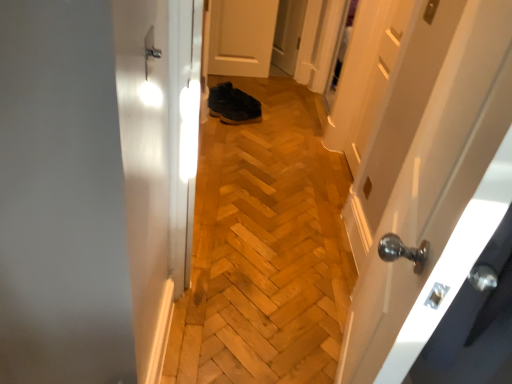
Image resolution: width=512 pixels, height=384 pixels. Find the location of `white matte door at center, marked as the 2th door in a bottom-to-top arrangement`. white matte door at center, marked as the 2th door in a bottom-to-top arrangement is located at coordinates (241, 37).

Can you confirm if satin nickel door handle at upper center is wider than wooden shoes at center?

No, satin nickel door handle at upper center is not wider than wooden shoes at center.

From a real-world perspective, does satin nickel door handle at upper center sit lower than wooden shoes at center?

Incorrect, from a real-world perspective, satin nickel door handle at upper center is higher than wooden shoes at center.

Is point (149, 35) closer to camera compared to point (270, 260)?

Yes, point (149, 35) is closer to viewer.

Is dark brown leather shoes at center with wooden shoes at center?

dark brown leather shoes at center and wooden shoes at center are not in contact.

Is point (224, 106) positioned in front of point (289, 155)?

No, (224, 106) is behind (289, 155).

Where is `corridor on the right of dark brown leather shoes at center`? The image size is (512, 384). corridor on the right of dark brown leather shoes at center is located at coordinates (265, 249).

Which of these two, dark brown leather shoes at center or wooden shoes at center, stands shorter?

With less height is wooden shoes at center.

Considering the sizes of objects white glossy door at right, the 2th door when ordered from top to bottom, and dark brown leather shoes at center in the image provided, who is smaller, white glossy door at right, the 2th door when ordered from top to bottom, or dark brown leather shoes at center?

dark brown leather shoes at center is smaller.

Based on the photo, from a real-world perspective, is white glossy door at right, the 2th door when ordered from top to bottom, physically above dark brown leather shoes at center?

Yes, from a real-world perspective, white glossy door at right, the 2th door when ordered from top to bottom, is over dark brown leather shoes at center

Does white glossy door at right, which is the first door in bottom-to-top order, have a lesser height compared to dark brown leather shoes at center?

No, white glossy door at right, which is the first door in bottom-to-top order, is not shorter than dark brown leather shoes at center.

From the image's perspective, is white glossy door at right, the 2th door in the back-to-front sequence, located beneath dark brown leather shoes at center?

Yes, from the image's perspective, white glossy door at right, the 2th door in the back-to-front sequence, is below dark brown leather shoes at center.

Does satin nickel door handle at upper center turn towards white glossy door at right, the 2th door when ordered from top to bottom?

Result: Yes, satin nickel door handle at upper center is oriented towards white glossy door at right, the 2th door when ordered from top to bottom.

Which is correct: satin nickel door handle at upper center is inside white glossy door at right, the 2th door when ordered from top to bottom, or outside of it?

satin nickel door handle at upper center is outside white glossy door at right, the 2th door when ordered from top to bottom.

Considering the positions of objects satin nickel door handle at upper center and white glossy door at right, the 2th door in the back-to-front sequence, in the image provided, who is behind, satin nickel door handle at upper center or white glossy door at right, the 2th door in the back-to-front sequence,?

satin nickel door handle at upper center is more distant.

Considering the positions of point (146, 64) and point (457, 200), is point (146, 64) closer or farther from the camera than point (457, 200)?

Point (146, 64) appears to be farther away from the viewer than point (457, 200).

Which object is positioned more to the left, wooden shoes at center or dark brown leather shoes at center?

From the viewer's perspective, dark brown leather shoes at center appears more on the left side.

Which of these two, wooden shoes at center or dark brown leather shoes at center, stands taller?

dark brown leather shoes at center.

Is wooden shoes at center bigger or smaller than dark brown leather shoes at center?

wooden shoes at center is bigger than dark brown leather shoes at center.

From a real-world perspective, is wooden shoes at center below dark brown leather shoes at center?

Yes, from a real-world perspective, wooden shoes at center is below dark brown leather shoes at center.

Is satin nickel door handle at upper center turned away from white matte door at center, which is counted as the first door, starting from the back?

No, satin nickel door handle at upper center's orientation is not away from white matte door at center, which is counted as the first door, starting from the back.

Is white matte door at center, placed as the 1th door when sorted from top to bottom, located within satin nickel door handle at upper center?

No, white matte door at center, placed as the 1th door when sorted from top to bottom, is not inside satin nickel door handle at upper center.

From a real-world perspective, which is physically below, satin nickel door handle at upper center or white matte door at center, marked as the 2th door in a bottom-to-top arrangement?

white matte door at center, marked as the 2th door in a bottom-to-top arrangement.

Can you confirm if white glossy door at right, the 1th door viewed from the front, is positioned to the right of white matte door at center, which is counted as the first door, starting from the back?

Correct, you'll find white glossy door at right, the 1th door viewed from the front, to the right of white matte door at center, which is counted as the first door, starting from the back.

Is white glossy door at right, the 2th door when ordered from top to bottom, looking in the opposite direction of white matte door at center, arranged as the second door when viewed from the front?

white glossy door at right, the 2th door when ordered from top to bottom, does not have its back to white matte door at center, arranged as the second door when viewed from the front.

In terms of height, does white glossy door at right, the 2th door in the back-to-front sequence, look taller or shorter compared to white matte door at center, marked as the 2th door in a bottom-to-top arrangement?

white glossy door at right, the 2th door in the back-to-front sequence, is taller than white matte door at center, marked as the 2th door in a bottom-to-top arrangement.

Which is behind, white glossy door at right, the 1th door viewed from the front, or white matte door at center, placed as the 1th door when sorted from top to bottom?

white matte door at center, placed as the 1th door when sorted from top to bottom, is more distant.

Locate an element on the screen. door handle that appears above the wooden shoes at center (from a real-world perspective) is located at coordinates (150, 49).

Find the location of a particular element. footwear behind the wooden shoes at center is located at coordinates [x=233, y=105].

Looking at the image, which one is located further to white glossy door at right, the 2th door when ordered from top to bottom, dark brown leather shoes at center or white matte door at center, placed as the 1th door when sorted from top to bottom?

Based on the image, white matte door at center, placed as the 1th door when sorted from top to bottom, appears to be further to white glossy door at right, the 2th door when ordered from top to bottom.

Estimate the real-world distances between objects in this image. Which object is further from dark brown leather shoes at center, white matte door at center, placed as the 1th door when sorted from top to bottom, or white glossy door at right, the 1th door viewed from the front?

white glossy door at right, the 1th door viewed from the front, is positioned further to the anchor dark brown leather shoes at center.

Considering their positions, is white glossy door at right, the 1th door viewed from the front, positioned closer to wooden shoes at center than dark brown leather shoes at center?

The object closer to wooden shoes at center is white glossy door at right, the 1th door viewed from the front.

When comparing their distances from dark brown leather shoes at center, does white matte door at center, which is counted as the first door, starting from the back, or wooden shoes at center seem closer?

white matte door at center, which is counted as the first door, starting from the back, is closer to dark brown leather shoes at center.

Based on their spatial positions, is white matte door at center, marked as the 2th door in a bottom-to-top arrangement, or satin nickel door handle at upper center further from wooden shoes at center?

Based on the image, white matte door at center, marked as the 2th door in a bottom-to-top arrangement, appears to be further to wooden shoes at center.

Based on their spatial positions, is satin nickel door handle at upper center or wooden shoes at center further from dark brown leather shoes at center?

The object further to dark brown leather shoes at center is satin nickel door handle at upper center.

Looking at the image, which one is located closer to white matte door at center, placed as the 1th door when sorted from top to bottom, satin nickel door handle at upper center or wooden shoes at center?

wooden shoes at center is positioned closer to the anchor white matte door at center, placed as the 1th door when sorted from top to bottom.

Based on their spatial positions, is dark brown leather shoes at center or satin nickel door handle at upper center further from white matte door at center, arranged as the second door when viewed from the front?

satin nickel door handle at upper center is further to white matte door at center, arranged as the second door when viewed from the front.

This screenshot has height=384, width=512. I want to click on corridor positioned between satin nickel door handle at upper center and dark brown leather shoes at center from near to far, so point(265,249).

Identify the location of corridor positioned between white glossy door at right, which is the first door in bottom-to-top order, and white matte door at center, placed as the 1th door when sorted from top to bottom, from near to far. This screenshot has width=512, height=384. (265, 249).

This screenshot has width=512, height=384. I want to click on door handle located between white glossy door at right, the 2th door in the back-to-front sequence, and white matte door at center, placed as the 1th door when sorted from top to bottom, in the depth direction, so click(x=150, y=49).

Image resolution: width=512 pixels, height=384 pixels. Find the location of `door handle located between white glossy door at right, which is the first door in bottom-to-top order, and wooden shoes at center in the depth direction`. door handle located between white glossy door at right, which is the first door in bottom-to-top order, and wooden shoes at center in the depth direction is located at coordinates (150, 49).